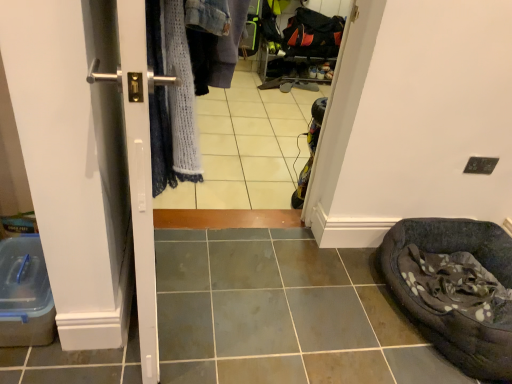
Question: Considering the positions of satin silver handle at left and white glossy tile at center in the image, is satin silver handle at left wider or thinner than white glossy tile at center?

Choices:
 (A) wide
 (B) thin

Answer: (B)

Question: Considering the positions of satin silver handle at left and white glossy tile at center in the image, is satin silver handle at left taller or shorter than white glossy tile at center?

Choices:
 (A) short
 (B) tall

Answer: (B)

Question: Estimate the real-world distances between objects in this image. Which object is closer to the white glossy tile at center?

Choices:
 (A) dark gray fabric bean bag at lower right
 (B) satin silver handle at left

Answer: (A)

Question: Considering the real-world distances, which object is closest to the white glossy tile at center?

Choices:
 (A) satin silver handle at left
 (B) dark gray fabric bean bag at lower right

Answer: (B)